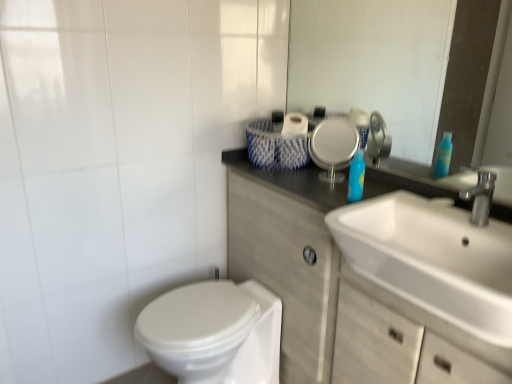
Question: From the image's perspective, is white woven basket at upper center located beneath blue glossy bottle at upper right?

Choices:
 (A) yes
 (B) no

Answer: (B)

Question: Is white woven basket at upper center shorter than blue glossy bottle at upper right?

Choices:
 (A) yes
 (B) no

Answer: (A)

Question: Could you tell me if white woven basket at upper center is turned towards blue glossy bottle at upper right?

Choices:
 (A) yes
 (B) no

Answer: (B)

Question: Considering the relative sizes of white woven basket at upper center and blue glossy bottle at upper right in the image provided, is white woven basket at upper center smaller than blue glossy bottle at upper right?

Choices:
 (A) no
 (B) yes

Answer: (A)

Question: Is blue glossy bottle at upper right completely or partially inside white woven basket at upper center?

Choices:
 (A) yes
 (B) no

Answer: (B)

Question: Is white woven basket at upper center closer to camera compared to blue glossy bottle at upper right?

Choices:
 (A) yes
 (B) no

Answer: (B)

Question: Could you tell me if white matte cabinet at center is turned towards glossy glass mirror at upper center?

Choices:
 (A) yes
 (B) no

Answer: (B)

Question: Is white matte cabinet at center outside glossy glass mirror at upper center?

Choices:
 (A) yes
 (B) no

Answer: (A)

Question: Does white matte cabinet at center have a smaller size compared to glossy glass mirror at upper center?

Choices:
 (A) no
 (B) yes

Answer: (A)

Question: Does white matte cabinet at center have a greater width compared to glossy glass mirror at upper center?

Choices:
 (A) yes
 (B) no

Answer: (A)

Question: Does white matte cabinet at center have a lesser width compared to glossy glass mirror at upper center?

Choices:
 (A) yes
 (B) no

Answer: (B)

Question: From the image's perspective, would you say white matte cabinet at center is shown under glossy glass mirror at upper center?

Choices:
 (A) yes
 (B) no

Answer: (A)

Question: From a real-world perspective, does glossy glass mirror at upper center stand above white glossy sink at right?

Choices:
 (A) no
 (B) yes

Answer: (B)